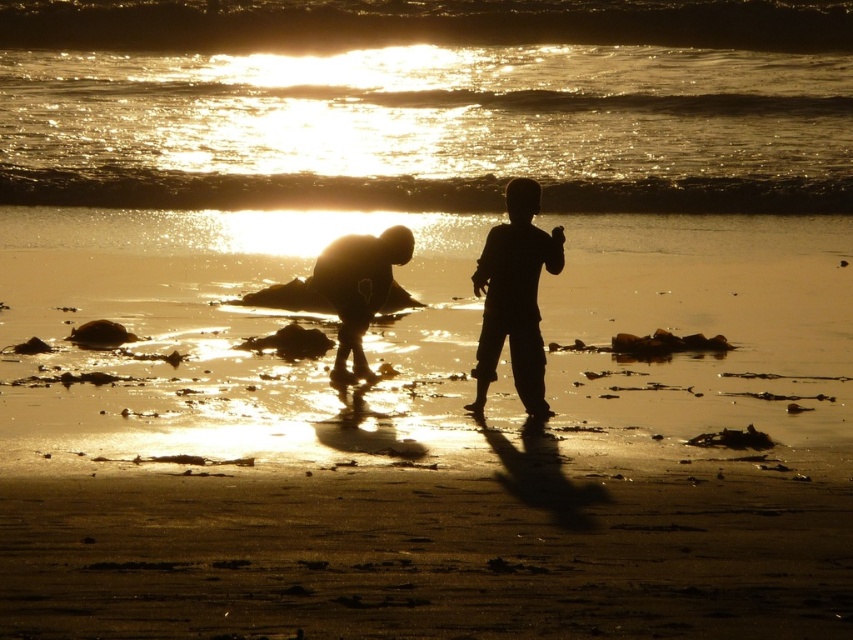
Is point (809, 340) positioned before point (347, 276)?

No, (809, 340) is behind (347, 276).

Who is lower down, sandy beach at center or silhouette sand at lower center?

silhouette sand at lower center is lower down.

Describe the element at coordinates (425, 440) in the screenshot. The height and width of the screenshot is (640, 853). I see `sandy beach at center` at that location.

I want to click on sandy beach at center, so click(425, 440).

The height and width of the screenshot is (640, 853). Identify the location of silhouette figure at center. (514, 298).

Can you confirm if silhouette figure at center is positioned to the left of silhouette sand at lower center?

No, silhouette figure at center is not to the left of silhouette sand at lower center.

What do you see at coordinates (514, 298) in the screenshot?
I see `silhouette figure at center` at bounding box center [514, 298].

Where is `silhouette figure at center`? This screenshot has width=853, height=640. silhouette figure at center is located at coordinates (514, 298).

Who is more distant from viewer, (688, 65) or (361, 328)?

The point (688, 65) is behind.

Consider the image. Between glistening golden water at upper center and silhouette sand at lower center, which one appears on the right side from the viewer's perspective?

glistening golden water at upper center is more to the right.

Is point (730, 29) closer to viewer compared to point (350, 376)?

No, it is not.

In order to click on glistening golden water at upper center in this screenshot , I will do `click(427, 104)`.